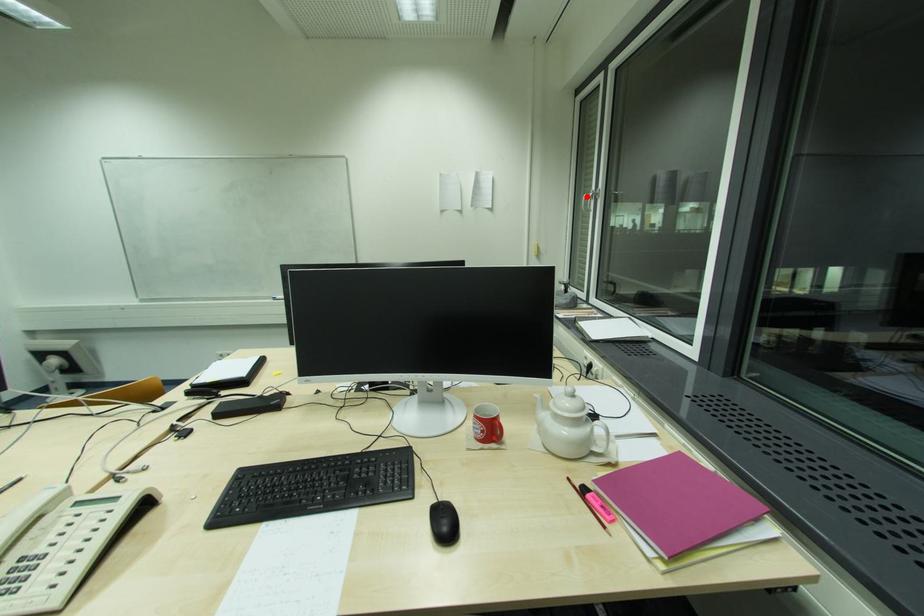
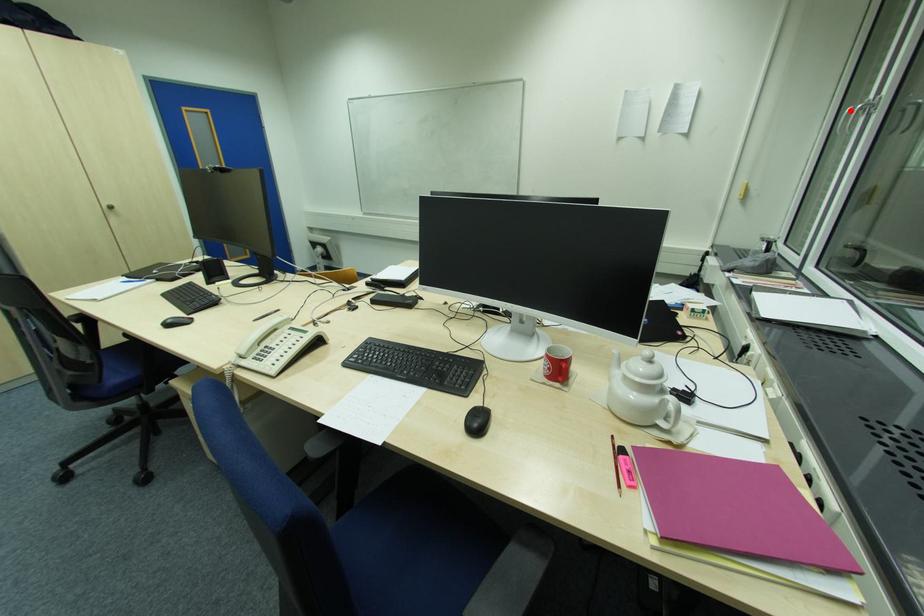
Based on the photo, I am providing you with two images of the same scene from different viewpoints. A red point is marked on the first image and another point is marked on the second image. Are the points marked in image1 and image2 representing the same 3D position?

Yes